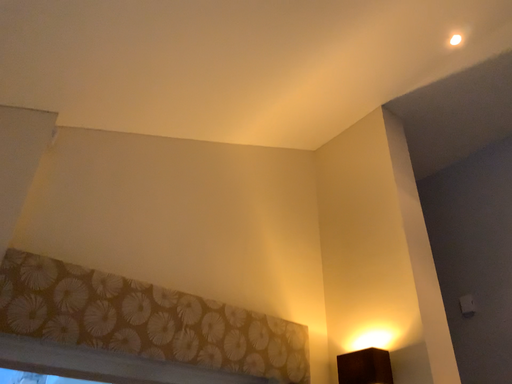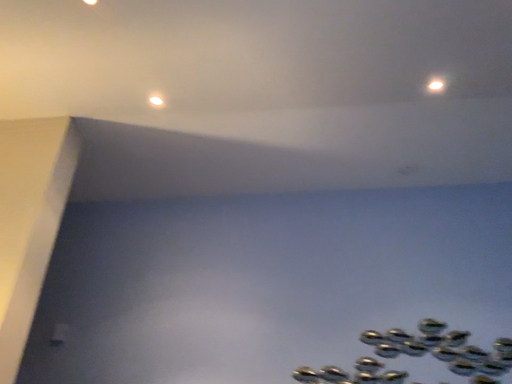
Question: How did the camera likely rotate when shooting the video?

Choices:
 (A) rotated right
 (B) rotated left

Answer: (A)